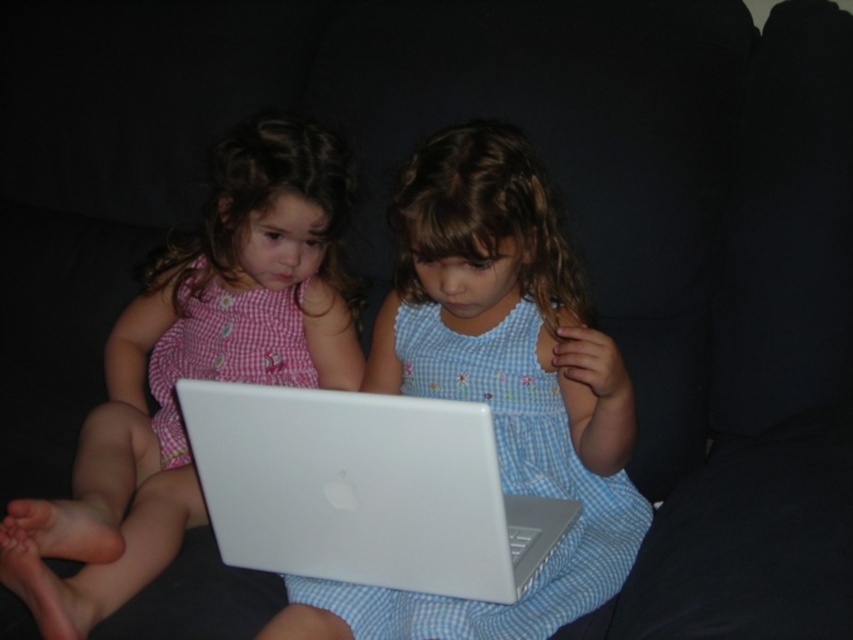
You are a photographer taking a picture of the matte white laptop at center and the matte pink dress at center. Which object will appear larger in the photo?

The matte white laptop at center will appear larger in the photo because it is closer to the viewer than the matte pink dress at center.